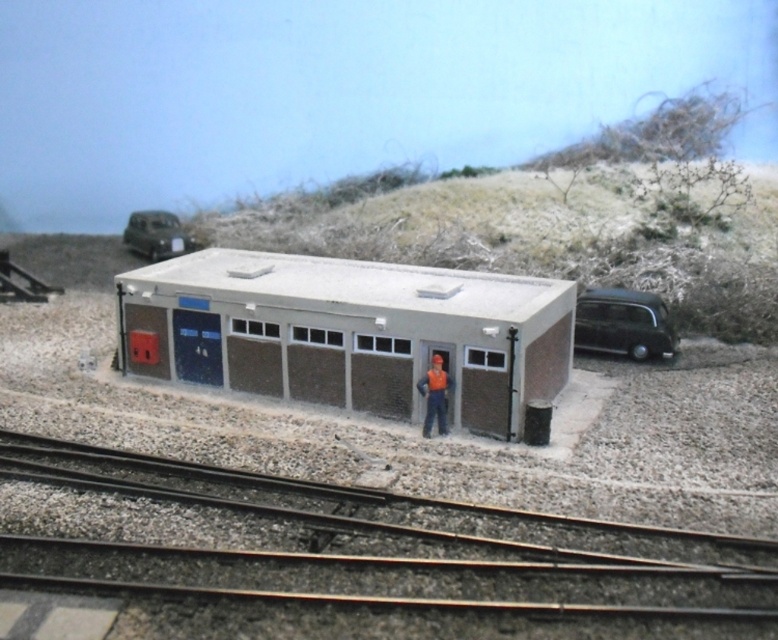
You are designing a miniature railway layout and want to place the matte gray shed at center and the orange fabric worker at center on the tracks. Which object will occupy more space horizontally on the layout?

The matte gray shed at center has a larger width than the orange fabric worker at center, so it will occupy more horizontal space on the layout.

You are a miniature train operator standing at the starting point of the railway tracks. You need to deliver a package to the point closer to the building. Which point should you go to, point (654, 337) or point (440, 356)?

You should go to point (440, 356) because it is closer to the building than point (654, 337), which is further away from the building.

You are a visitor at the model railway exhibit and want to take a photo of the shiny black car at right and the orange fabric worker at center. Which object is closer to you in the scene?

The shiny black car at right is closer to you than the orange fabric worker at center.